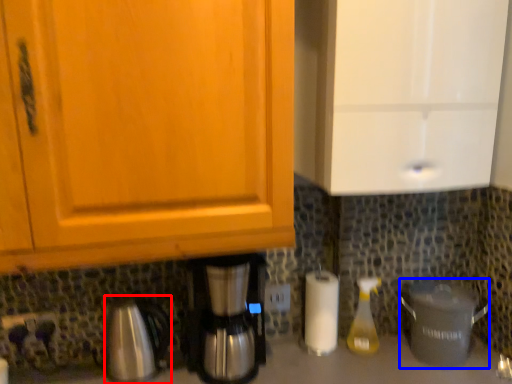
Question: Which point is closer to the camera, coffeepot (highlighted by a red box) or crock pot (highlighted by a blue box)?

Choices:
 (A) coffeepot
 (B) crock pot

Answer: (A)